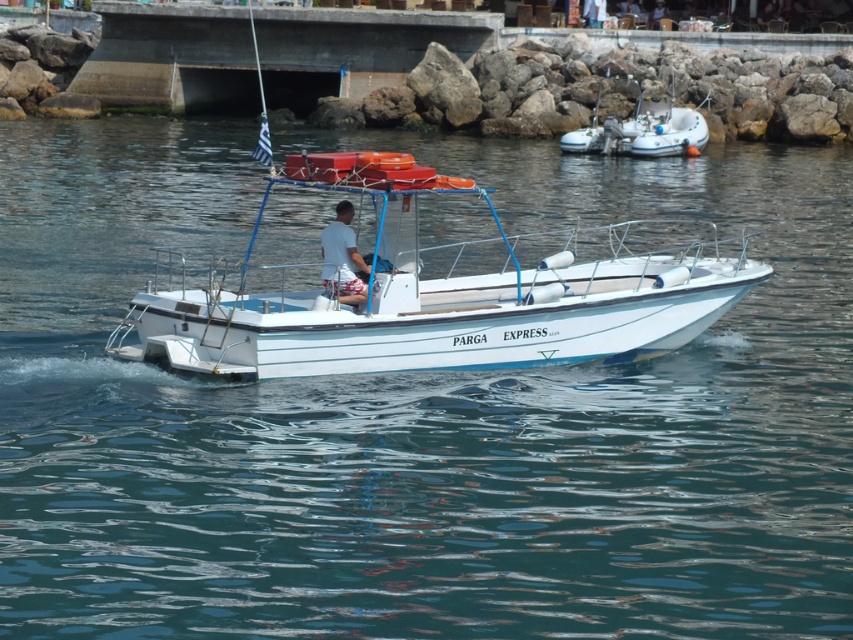
Question: Which point is closer to the camera taking this photo?

Choices:
 (A) (357, 294)
 (B) (283, 314)
 (C) (593, 129)

Answer: (B)

Question: Is white rubber dinghy at upper right positioned before white printed shorts at center?

Choices:
 (A) no
 (B) yes

Answer: (A)

Question: Among these objects, which one is nearest to the camera?

Choices:
 (A) white printed shorts at center
 (B) white rubber dinghy at upper right
 (C) white matte boat at center

Answer: (C)

Question: Can you confirm if white matte boat at center is positioned to the right of white printed shorts at center?

Choices:
 (A) yes
 (B) no

Answer: (A)

Question: Can you confirm if white rubber dinghy at upper right is positioned above white printed shorts at center?

Choices:
 (A) no
 (B) yes

Answer: (B)

Question: Which of the following is the closest to the observer?

Choices:
 (A) white printed shorts at center
 (B) white matte boat at center
 (C) white rubber dinghy at upper right

Answer: (B)